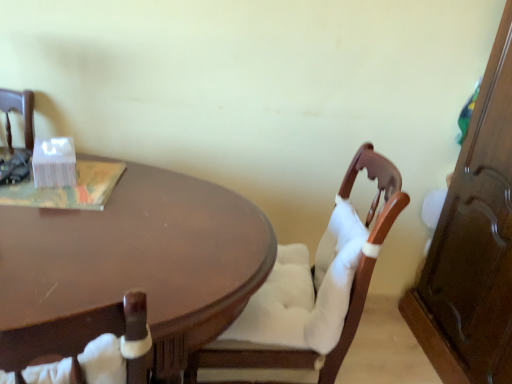
You are a GUI agent. You are given a task and a screenshot of the screen. Output one action in this format:
    pyautogui.click(x=<x>, y=<y>)
    Task: Click on the shiny brown table at center
    The width and height of the screenshot is (512, 384).
    Given the screenshot: What is the action you would take?
    pyautogui.click(x=131, y=268)

What do you see at coordinates (131, 268) in the screenshot?
I see `shiny brown table at center` at bounding box center [131, 268].

What is the approximate width of white fabric chair at center?

white fabric chair at center is 23.18 inches wide.

Identify the location of white fabric chair at center. (313, 288).

The height and width of the screenshot is (384, 512). What do you see at coordinates (313, 288) in the screenshot?
I see `white fabric chair at center` at bounding box center [313, 288].

The image size is (512, 384). I want to click on shiny brown table at center, so click(x=131, y=268).

Considering the relative positions of shiny brown table at center and white fabric chair at center in the image provided, is shiny brown table at center to the left of white fabric chair at center from the viewer's perspective?

Yes, shiny brown table at center is to the left of white fabric chair at center.

Relative to white fabric chair at center, is shiny brown table at center in front or behind?

shiny brown table at center is in front of white fabric chair at center.

Considering the positions of point (111, 281) and point (375, 159), is point (111, 281) closer or farther from the camera than point (375, 159)?

Point (111, 281) is positioned closer to the camera compared to point (375, 159).

From the image's perspective, which is below, shiny brown table at center or white fabric chair at center?

shiny brown table at center, from the image's perspective.

From a real-world perspective, is shiny brown table at center above or below white fabric chair at center?

Clearly, from a real-world perspective, shiny brown table at center is below white fabric chair at center.

Between shiny brown table at center and white fabric chair at center, which one has smaller width?

white fabric chair at center.

Can you confirm if shiny brown table at center is taller than white fabric chair at center?

No, shiny brown table at center is not taller than white fabric chair at center.

Who is bigger, shiny brown table at center or white fabric chair at center?

shiny brown table at center is bigger.

Would you say shiny brown table at center is outside white fabric chair at center?

That's correct, shiny brown table at center is outside of white fabric chair at center.

Is shiny brown table at center far from white fabric chair at center?

They are positioned close to each other.

Could you tell me if shiny brown table at center is facing white fabric chair at center?

No.

How many degrees apart are the facing directions of shiny brown table at center and white fabric chair at center?

There is a 91.5-degree angle between the facing directions of shiny brown table at center and white fabric chair at center.

Where is `chair that is on the right side of shiny brown table at center`? chair that is on the right side of shiny brown table at center is located at coordinates (313, 288).

Can you confirm if white fabric chair at center is positioned to the right of shiny brown table at center?

Indeed, white fabric chair at center is positioned on the right side of shiny brown table at center.

Is white fabric chair at center further to camera compared to shiny brown table at center?

Yes.

Which is less distant, [298,317] or [38,338]?

Point [298,317] is positioned farther from the camera compared to point [38,338].

From the image's perspective, which is above, white fabric chair at center or shiny brown table at center?

white fabric chair at center.

From a real-world perspective, who is located higher, white fabric chair at center or shiny brown table at center?

white fabric chair at center is physically above.

Is white fabric chair at center thinner than shiny brown table at center?

Indeed, white fabric chair at center has a lesser width compared to shiny brown table at center.

Who is taller, white fabric chair at center or shiny brown table at center?

white fabric chair at center is taller.

Between white fabric chair at center and shiny brown table at center, which one has smaller size?

With smaller size is white fabric chair at center.

Which is correct: white fabric chair at center is inside shiny brown table at center, or outside of it?

white fabric chair at center is spatially positioned inside shiny brown table at center.

Would you consider white fabric chair at center to be distant from shiny brown table at center?

No, white fabric chair at center is not far away from shiny brown table at center.

From the picture: Is white fabric chair at center aimed at shiny brown table at center?

Yes, white fabric chair at center faces towards shiny brown table at center.

Can you tell me how much white fabric chair at center and shiny brown table at center differ in facing direction?

91.5 degrees separate the facing orientations of white fabric chair at center and shiny brown table at center.

You are a GUI agent. You are given a task and a screenshot of the screen. Output one action in this format:
    pyautogui.click(x=<x>, y=<y>)
    Task: Click on the chair above the shiny brown table at center (from a real-world perspective)
    
    Given the screenshot: What is the action you would take?
    pyautogui.click(x=313, y=288)

You are a GUI agent. You are given a task and a screenshot of the screen. Output one action in this format:
    pyautogui.click(x=<x>, y=<y>)
    Task: Click on the chair lying on the right of shiny brown table at center
    Image resolution: width=512 pixels, height=384 pixels.
    Given the screenshot: What is the action you would take?
    pyautogui.click(x=313, y=288)

Find the location of a particular element. The width and height of the screenshot is (512, 384). coffee table to the left of white fabric chair at center is located at coordinates pos(131,268).